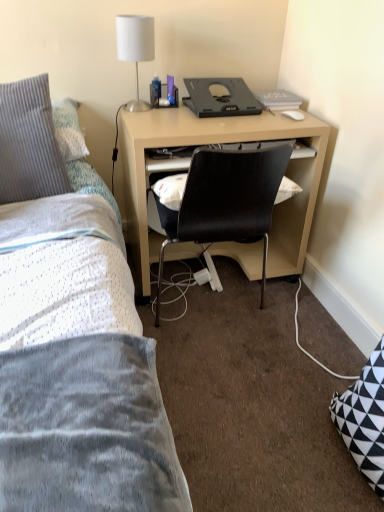
Identify the location of free space in front of matte wood computer desk at center. The image size is (384, 512). (258, 365).